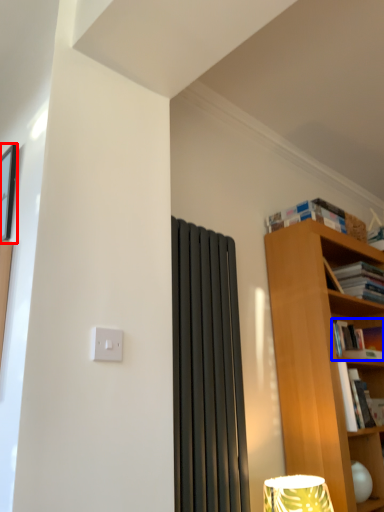
Question: Which of the following is the closest to the observer, picture frame (highlighted by a red box) or book (highlighted by a blue box)?

Choices:
 (A) picture frame
 (B) book

Answer: (A)